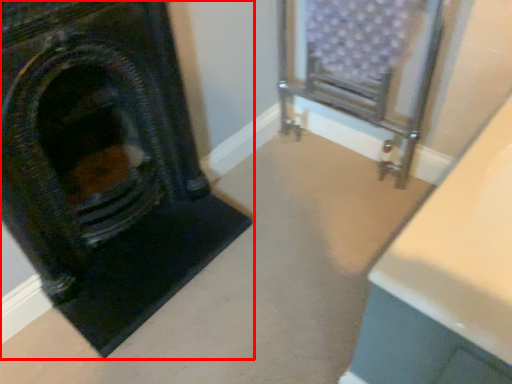
Question: From the image, what is the correct spatial relationship of fireplace (annotated by the red box) in relation to furniture?

Choices:
 (A) left
 (B) right

Answer: (A)